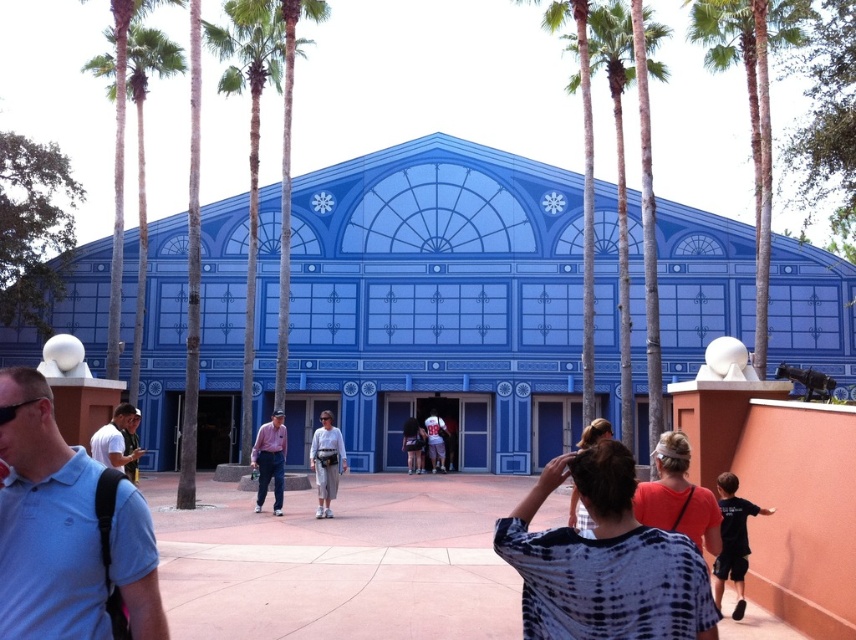
This screenshot has height=640, width=856. What do you see at coordinates (259, 138) in the screenshot? I see `green leafy palm tree at center` at bounding box center [259, 138].

Measure the distance from green leafy palm tree at center to orange t-shirt at center.

green leafy palm tree at center is 44.85 meters from orange t-shirt at center.

Image resolution: width=856 pixels, height=640 pixels. What do you see at coordinates (259, 138) in the screenshot?
I see `green leafy palm tree at center` at bounding box center [259, 138].

Locate an element on the screen. green leafy palm tree at center is located at coordinates (259, 138).

Which of these two, green leafy palm tree at upper right or brown wood palm tree at center, stands shorter?

Standing shorter between the two is green leafy palm tree at upper right.

Between green leafy palm tree at upper right and brown wood palm tree at center, which one has more height?

brown wood palm tree at center

Is point (734, 36) farther from camera compared to point (626, 19)?

Yes, it is behind point (626, 19).

The image size is (856, 640). I want to click on green leafy palm tree at upper right, so click(x=752, y=104).

In the scene shown: Who is positioned more to the left, black tie-dye shirt at center or white jersey at center?

From the viewer's perspective, white jersey at center appears more on the left side.

Can you confirm if black tie-dye shirt at center is bigger than white jersey at center?

Correct, black tie-dye shirt at center is larger in size than white jersey at center.

Describe the element at coordinates (578, 513) in the screenshot. I see `black tie-dye shirt at center` at that location.

I want to click on black tie-dye shirt at center, so click(x=578, y=513).